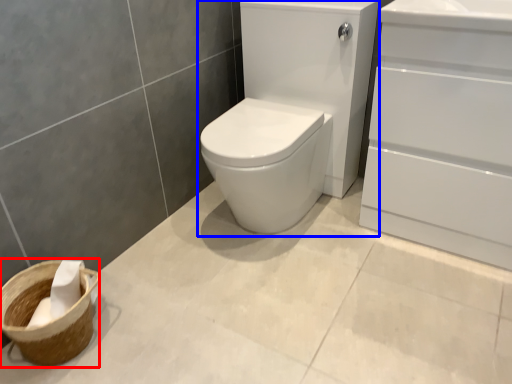
Question: Among these objects, which one is nearest to the camera, basket container (highlighted by a red box) or sink (highlighted by a blue box)?

Choices:
 (A) basket container
 (B) sink

Answer: (B)